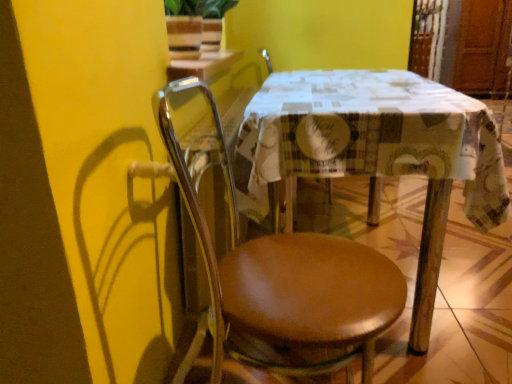
Question: Can you confirm if printed fabric table at center is shorter than brown leather chair at center?

Choices:
 (A) yes
 (B) no

Answer: (A)

Question: Is brown leather chair at center surrounded by printed fabric table at center?

Choices:
 (A) no
 (B) yes

Answer: (A)

Question: From a real-world perspective, does printed fabric table at center sit lower than brown leather chair at center?

Choices:
 (A) yes
 (B) no

Answer: (A)

Question: Is printed fabric table at center located outside brown leather chair at center?

Choices:
 (A) no
 (B) yes

Answer: (B)

Question: From a real-world perspective, is printed fabric table at center physically above brown leather chair at center?

Choices:
 (A) no
 (B) yes

Answer: (A)

Question: Are printed fabric table at center and brown leather chair at center making contact?

Choices:
 (A) no
 (B) yes

Answer: (A)

Question: Is brown leather chair at center turned away from printed fabric table at center?

Choices:
 (A) no
 (B) yes

Answer: (A)

Question: Is brown leather chair at center smaller than printed fabric table at center?

Choices:
 (A) no
 (B) yes

Answer: (B)

Question: Is brown leather chair at center further to the viewer compared to printed fabric table at center?

Choices:
 (A) yes
 (B) no

Answer: (B)

Question: From a real-world perspective, does brown leather chair at center sit lower than printed fabric table at center?

Choices:
 (A) no
 (B) yes

Answer: (A)

Question: From the image's perspective, is brown leather chair at center above printed fabric table at center?

Choices:
 (A) no
 (B) yes

Answer: (A)

Question: Does brown leather chair at center have a lesser height compared to printed fabric table at center?

Choices:
 (A) no
 (B) yes

Answer: (A)

Question: Relative to brown leather chair at center, is printed fabric table at center in front or behind?

Choices:
 (A) behind
 (B) front

Answer: (A)